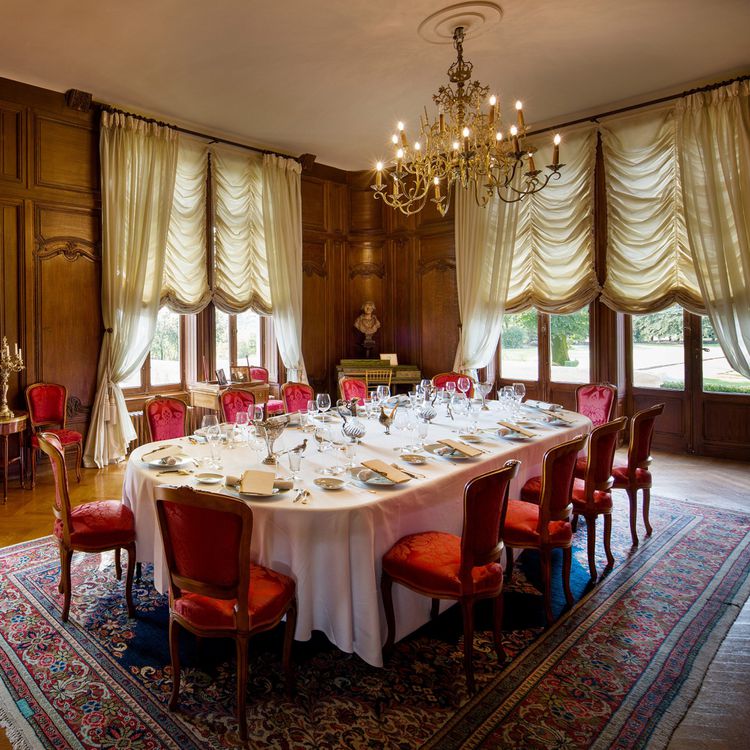
Identify the location of chair. The image size is (750, 750). (354, 430).